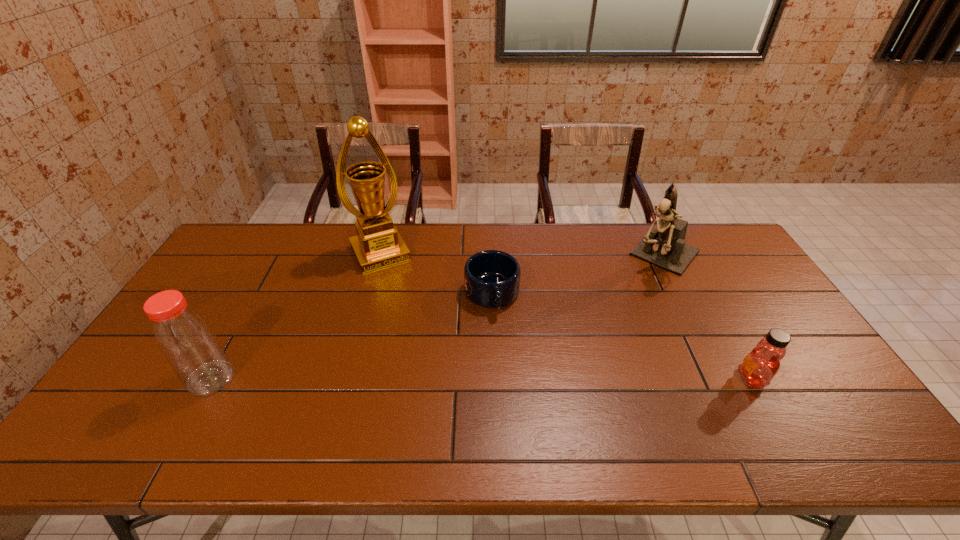
The width and height of the screenshot is (960, 540). What are the coordinates of `vacant space located on the front label of the honey` in the screenshot? It's located at (695, 379).

At what (x,y) coordinates should I click in order to perform the action: click on vacant space located on the front label of the honey. Please return your answer as a coordinate pair (x, y). This screenshot has height=540, width=960. Looking at the image, I should click on (718, 379).

Where is `vacant space located 0.230m on the front-facing side of the award`? vacant space located 0.230m on the front-facing side of the award is located at coordinates (413, 316).

Where is `vacant space situated 0.390m on the front-facing side of the award`? This screenshot has height=540, width=960. vacant space situated 0.390m on the front-facing side of the award is located at coordinates click(432, 355).

Where is `vacant area located 0.240m on the front-facing side of the award`? The width and height of the screenshot is (960, 540). vacant area located 0.240m on the front-facing side of the award is located at coordinates click(414, 319).

Locate an element on the screen. The width and height of the screenshot is (960, 540). vacant region located 0.260m on the front-facing side of the second tallest object is located at coordinates (612, 321).

What are the coordinates of `blank space located on the front-facing side of the second tallest object` in the screenshot? It's located at (612, 321).

Where is `free space located on the front-facing side of the second tallest object`? This screenshot has height=540, width=960. free space located on the front-facing side of the second tallest object is located at coordinates (642, 285).

Where is `vacant region located 0.160m with the handle on the side of the shortest object`? vacant region located 0.160m with the handle on the side of the shortest object is located at coordinates (506, 361).

Find the location of a particular element. vacant region located 0.250m with the handle on the side of the shortest object is located at coordinates (513, 389).